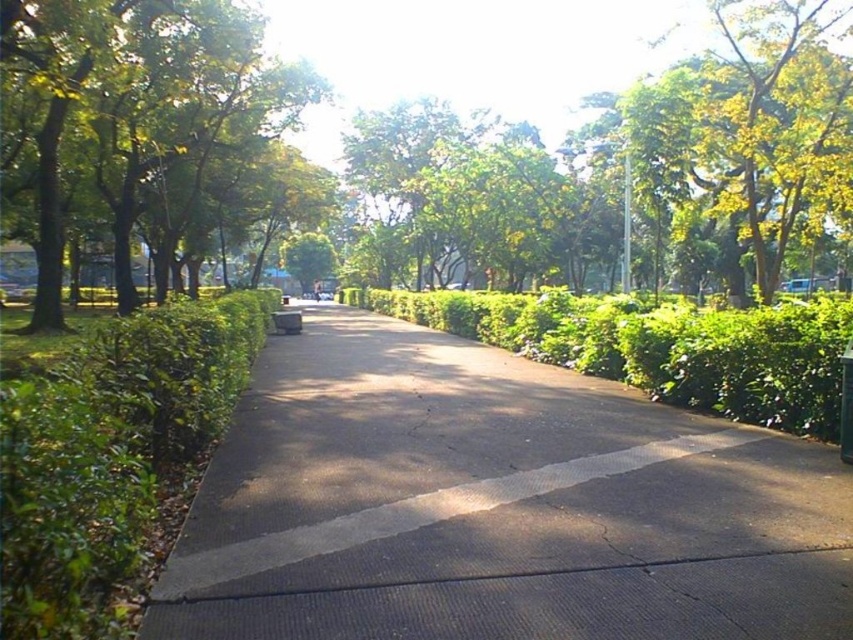
Where is `green leafy tree at center`? green leafy tree at center is located at coordinates (646, 168).

Is green leafy tree at center taller than green leafy hedge at left?

Indeed, green leafy tree at center has a greater height compared to green leafy hedge at left.

Which is in front, point (735, 256) or point (39, 529)?

Point (39, 529) is in front.

You are a GUI agent. You are given a task and a screenshot of the screen. Output one action in this format:
    pyautogui.click(x=<x>, y=<y>)
    Task: Click on the green leafy tree at center
    Image resolution: width=853 pixels, height=640 pixels.
    Given the screenshot: What is the action you would take?
    pyautogui.click(x=646, y=168)

Who is more forward, (596, 442) or (73, 628)?

Point (73, 628) is in front.

Does point (247, 614) come in front of point (22, 572)?

That is False.

Find the location of a particular element. dark gray asphalt at center is located at coordinates (495, 506).

Is dark gray asphalt at center further to camera compared to green leafy hedge at center?

No, dark gray asphalt at center is in front of green leafy hedge at center.

Is point (763, 586) behind point (485, 337)?

That is False.

In order to click on dark gray asphalt at center in this screenshot , I will do `click(495, 506)`.